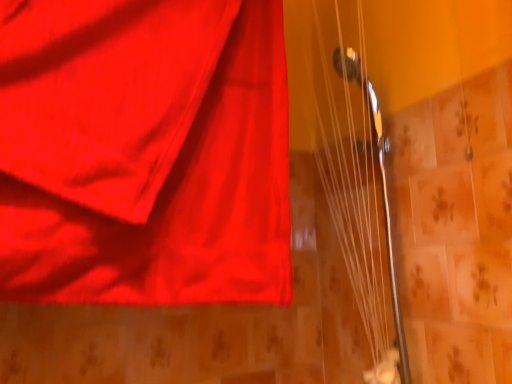
Question: Is matte red curtain at upper left spatially inside metallic silver strings at upper right, or outside of it?

Choices:
 (A) outside
 (B) inside

Answer: (A)

Question: Is point (105, 297) positioned closer to the camera than point (350, 344)?

Choices:
 (A) closer
 (B) farther

Answer: (A)

Question: Is matte red curtain at upper left taller or shorter than metallic silver strings at upper right?

Choices:
 (A) tall
 (B) short

Answer: (B)

Question: Visually, is metallic silver strings at upper right positioned to the left or to the right of matte red curtain at upper left?

Choices:
 (A) right
 (B) left

Answer: (A)

Question: From a real-world perspective, is metallic silver strings at upper right positioned above or below matte red curtain at upper left?

Choices:
 (A) below
 (B) above

Answer: (A)

Question: From the image's perspective, is metallic silver strings at upper right positioned above or below matte red curtain at upper left?

Choices:
 (A) below
 (B) above

Answer: (A)

Question: Looking at the image, does metallic silver strings at upper right seem bigger or smaller compared to matte red curtain at upper left?

Choices:
 (A) small
 (B) big

Answer: (A)